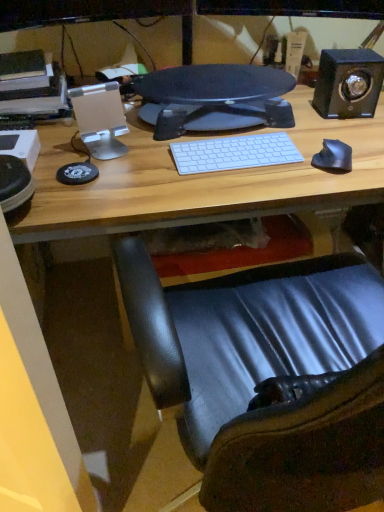
The image size is (384, 512). In order to click on free space to the left of white matte keyboard at center in this screenshot , I will do `click(142, 161)`.